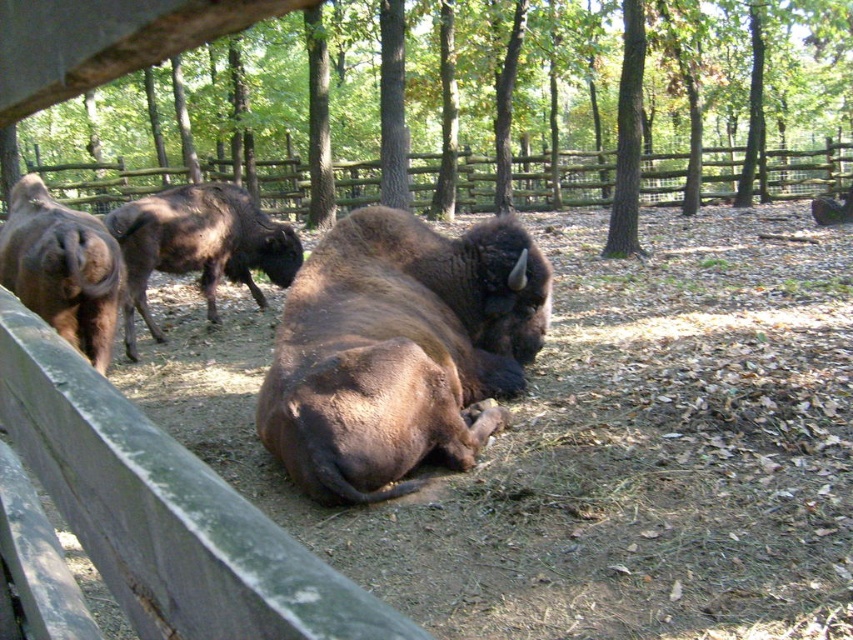
Question: Considering the real-world distances, which object is farthest from the brown furry bison at left?

Choices:
 (A) brown shaggy bison at upper left
 (B) brown furry bison at center

Answer: (B)

Question: Is brown shaggy bison at upper left positioned before brown furry bison at left?

Choices:
 (A) no
 (B) yes

Answer: (A)

Question: Which of the following is the closest to the observer?

Choices:
 (A) wooden fence at center
 (B) brown furry bison at center

Answer: (B)

Question: Which of the following is the farthest from the observer?

Choices:
 (A) wooden fence at center
 (B) brown shaggy bison at upper left
 (C) brown furry bison at center

Answer: (A)

Question: Where is brown furry bison at center located in relation to brown furry bison at left in the image?

Choices:
 (A) above
 (B) below

Answer: (B)

Question: Does brown furry bison at center appear on the left side of brown furry bison at left?

Choices:
 (A) no
 (B) yes

Answer: (A)